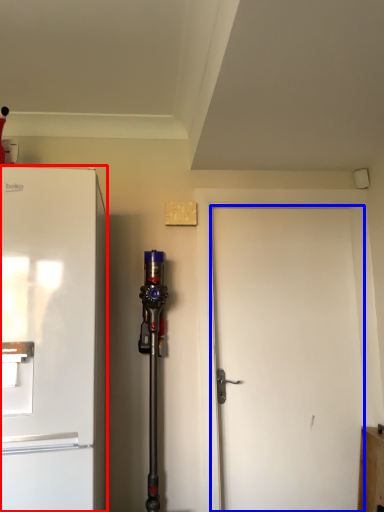
Question: Among these objects, which one is farthest to the camera, refrigerator (highlighted by a red box) or door (highlighted by a blue box)?

Choices:
 (A) refrigerator
 (B) door

Answer: (B)